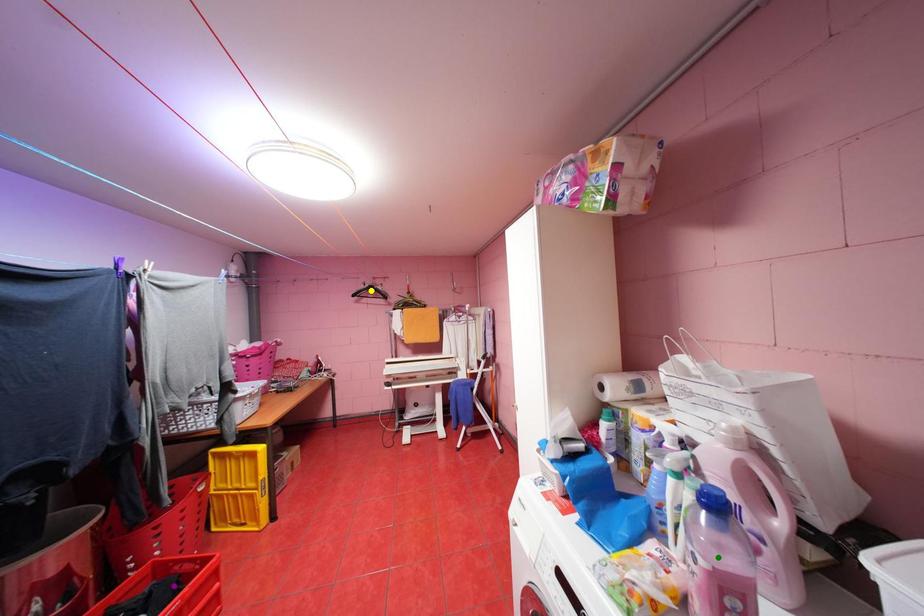
Order these from nearest to farthest:
1. yellow point
2. purple point
3. green point

yellow point, purple point, green point